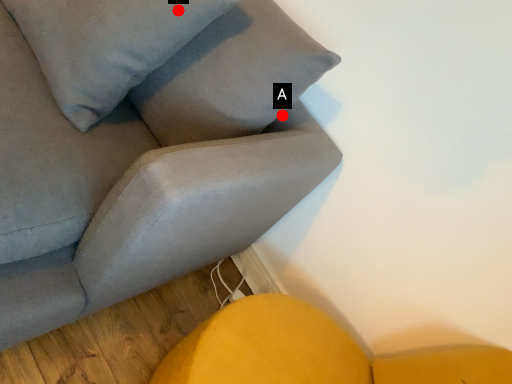
Question: Two points are circled on the image, labeled by A and B beside each circle. Which of the following is the farthest from the observer?

Choices:
 (A) A is further
 (B) B is further

Answer: (A)